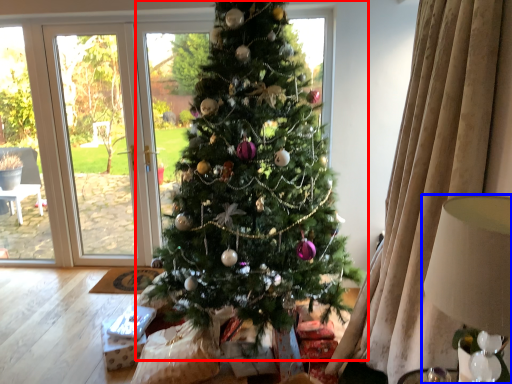
Question: Which point is closer to the camera, christmas tree (highlighted by a red box) or lamp (highlighted by a blue box)?

Choices:
 (A) christmas tree
 (B) lamp

Answer: (B)